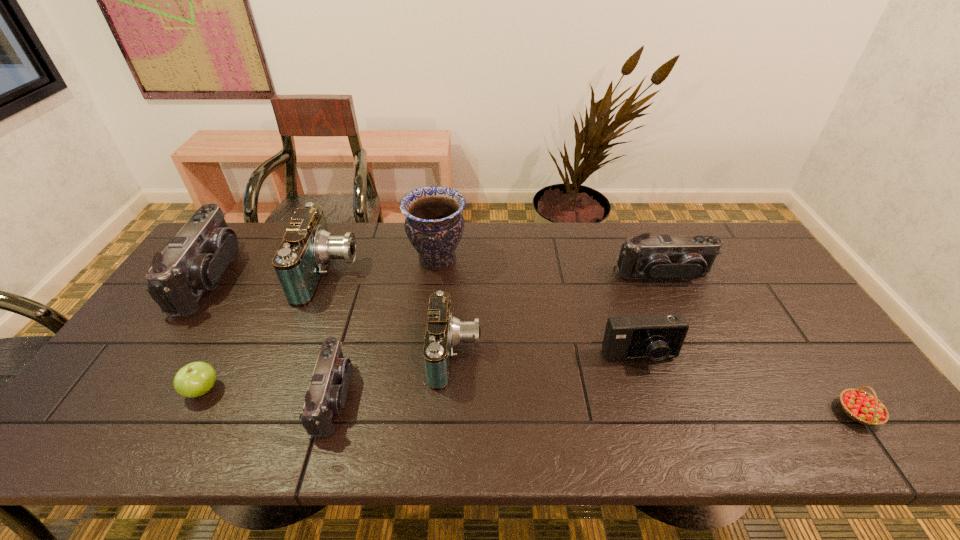
Image resolution: width=960 pixels, height=540 pixels. Find the location of `free location located 0.300m on the front-facing side of the fourth camcorder from left to right`. free location located 0.300m on the front-facing side of the fourth camcorder from left to right is located at coordinates click(596, 354).

Locate an element on the screen. vacant space situated on the front-facing side of the camera is located at coordinates (660, 422).

You are a GUI agent. You are given a task and a screenshot of the screen. Output one action in this format:
    pyautogui.click(x=<x>, y=<y>)
    Task: Click on the vacant space located 0.060m on the front-facing side of the smallest black camcorder
    Image resolution: width=960 pixels, height=540 pixels.
    Given the screenshot: What is the action you would take?
    pyautogui.click(x=375, y=397)

Identify the location of free space located 0.220m on the back of the green apple. (246, 311).

At what (x,y) coordinates should I click in order to perform the action: click on free spot located 0.090m on the back of the brown strawberry. Please return your answer as a coordinate pair (x, y). This screenshot has height=540, width=960. Looking at the image, I should click on (824, 364).

The width and height of the screenshot is (960, 540). I want to click on pottery that is at the far edge, so click(434, 225).

You are a GUI agent. You are given a task and a screenshot of the screen. Output one action in this format:
    pyautogui.click(x=<x>, y=<y>)
    Task: Click on the camcorder that is positioned at the near edge
    The width and height of the screenshot is (960, 540).
    Given the screenshot: What is the action you would take?
    pyautogui.click(x=326, y=395)

Locate an element on the screen. The height and width of the screenshot is (540, 960). strawberry present at the near edge is located at coordinates (862, 407).

Where is `object located in the left edge section of the desktop`? This screenshot has width=960, height=540. object located in the left edge section of the desktop is located at coordinates (194, 260).

You are a GUI agent. You are given a task and a screenshot of the screen. Output one action in this format:
    pyautogui.click(x=<x>, y=<y>)
    Task: Click on the object that is at the right edge
    Image resolution: width=960 pixels, height=540 pixels.
    Given the screenshot: What is the action you would take?
    pyautogui.click(x=862, y=407)